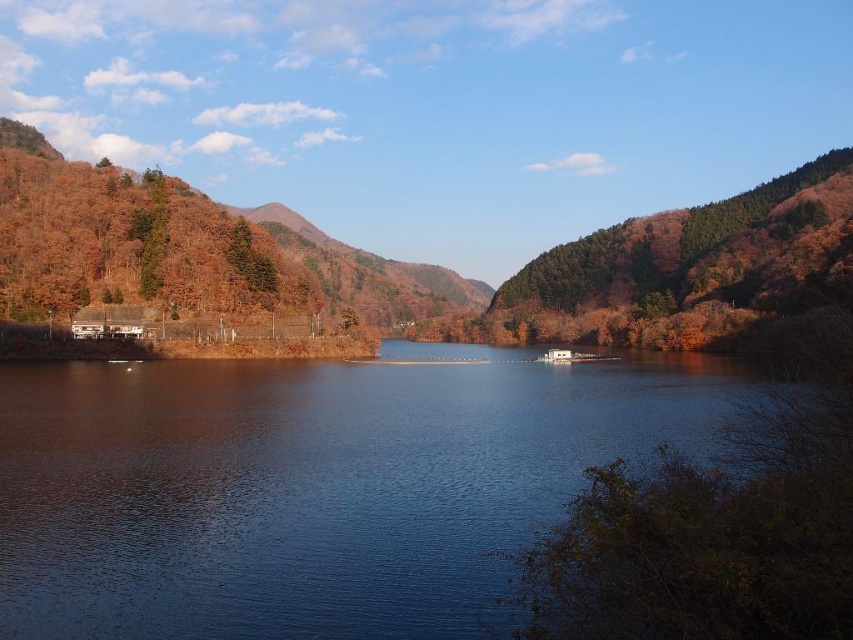
Which is in front, point (302, 225) or point (149, 170)?

Point (149, 170)

The height and width of the screenshot is (640, 853). Describe the element at coordinates (67, 221) in the screenshot. I see `brown textured hillside at left` at that location.

Who is more distant from viewer, (392, 276) or (152, 272)?

The point (392, 276) is more distant.

Find the location of a particular element. Image resolution: width=853 pixels, height=640 pixels. brown textured hillside at left is located at coordinates (67, 221).

Does point (148, 596) come farther from viewer compared to point (0, 232)?

No, it is in front of (0, 232).

Which is more to the right, blue water at center or brown textured hillside at left?

blue water at center

I want to click on blue water at center, so click(312, 484).

Is point (64, 500) less distant than point (148, 244)?

Yes, it is.

Identify the location of blue water at center. (312, 484).

Is point (235, 548) farther from viewer compared to point (149, 292)?

No, it is in front of (149, 292).

Identify the location of blue water at center. This screenshot has height=640, width=853. (312, 484).